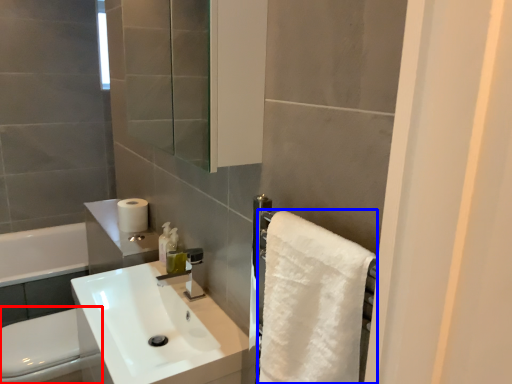
Question: Among these objects, which one is nearest to the camera, toilet bowl (highlighted by a red box) or bath towel (highlighted by a blue box)?

Choices:
 (A) toilet bowl
 (B) bath towel

Answer: (B)